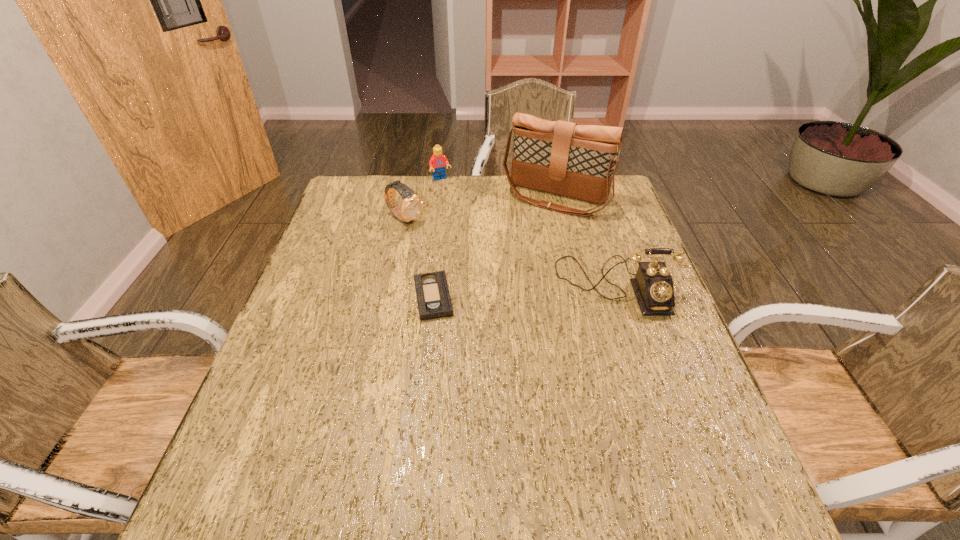
Find the location of a particular element. The height and width of the screenshot is (540, 960). shoulder bag located at the right edge is located at coordinates (578, 161).

I want to click on object present at the far right corner, so click(x=578, y=161).

Locate an element on the screen. vacant space at the far edge is located at coordinates (432, 188).

Where is `vacant space at the near edge of the desktop`? Image resolution: width=960 pixels, height=540 pixels. vacant space at the near edge of the desktop is located at coordinates (477, 438).

The image size is (960, 540). In order to click on vacant region at the left edge in this screenshot , I will do `click(351, 241)`.

Where is `vacant space at the right edge`? This screenshot has height=540, width=960. vacant space at the right edge is located at coordinates (642, 341).

Where is `free space at the far left corner of the desktop`? The width and height of the screenshot is (960, 540). free space at the far left corner of the desktop is located at coordinates (369, 209).

The width and height of the screenshot is (960, 540). In the image, there is a desktop. Identify the location of vacant space at the near left corner. (252, 450).

Identify the location of vacant space at the far right corner of the desktop. The width and height of the screenshot is (960, 540). (588, 205).

Find the location of a particular element. Image resolution: width=960 pixels, height=540 pixels. unoccupied area between the watch and the shortest object is located at coordinates (419, 259).